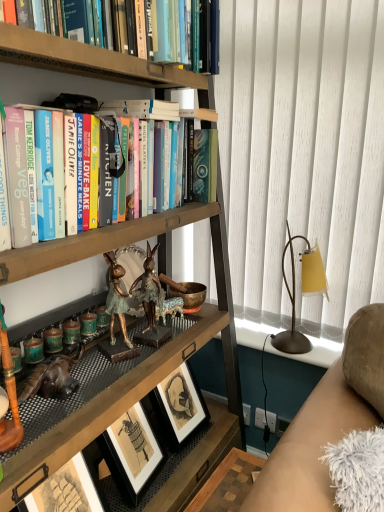
Question: Can you confirm if matte gold table lamp at right is shorter than hardcover books at upper left?

Choices:
 (A) no
 (B) yes

Answer: (A)

Question: Is matte gold table lamp at right to the right of hardcover books at upper left from the viewer's perspective?

Choices:
 (A) yes
 (B) no

Answer: (A)

Question: Is matte gold table lamp at right positioned behind hardcover books at upper left?

Choices:
 (A) no
 (B) yes

Answer: (B)

Question: Is the position of matte gold table lamp at right less distant than that of hardcover books at upper left?

Choices:
 (A) yes
 (B) no

Answer: (B)

Question: Is matte gold table lamp at right not inside hardcover books at upper left?

Choices:
 (A) yes
 (B) no

Answer: (A)

Question: Does matte gold table lamp at right have a greater height compared to hardcover books at upper left?

Choices:
 (A) no
 (B) yes

Answer: (B)

Question: Is matte gold table lamp at right wider than suede-like beige couch at lower right?

Choices:
 (A) yes
 (B) no

Answer: (B)

Question: Is matte gold table lamp at right facing away from suede-like beige couch at lower right?

Choices:
 (A) no
 (B) yes

Answer: (A)

Question: Is there a large distance between matte gold table lamp at right and suede-like beige couch at lower right?

Choices:
 (A) no
 (B) yes

Answer: (A)

Question: From the image's perspective, would you say matte gold table lamp at right is shown under suede-like beige couch at lower right?

Choices:
 (A) yes
 (B) no

Answer: (B)

Question: Is matte gold table lamp at right shorter than suede-like beige couch at lower right?

Choices:
 (A) no
 (B) yes

Answer: (B)

Question: Is matte gold table lamp at right to the left of suede-like beige couch at lower right from the viewer's perspective?

Choices:
 (A) yes
 (B) no

Answer: (B)

Question: From the image's perspective, is suede-like beige couch at lower right located above matte gold table lamp at right?

Choices:
 (A) no
 (B) yes

Answer: (A)